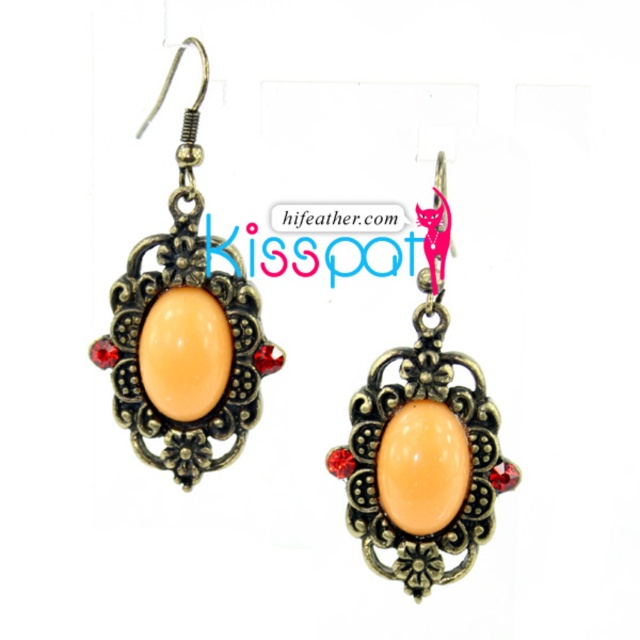
Question: Is the position of matte orange stone at center more distant than that of matte gold earring at center?

Choices:
 (A) no
 (B) yes

Answer: (B)

Question: Which of the following is the farthest from the observer?

Choices:
 (A) (x=364, y=444)
 (B) (x=125, y=355)

Answer: (B)

Question: Is matte orange stone at center wider than matte gold earring at center?

Choices:
 (A) no
 (B) yes

Answer: (B)

Question: Which point appears closest to the camera in this image?

Choices:
 (A) (150, 353)
 (B) (499, 461)

Answer: (B)

Question: Does matte orange stone at center have a larger size compared to matte gold earring at center?

Choices:
 (A) no
 (B) yes

Answer: (B)